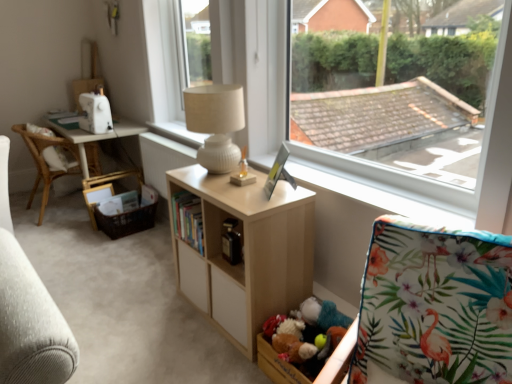
Where is `vacant region in front of white ribbed ceramic lamp at upper center`? The width and height of the screenshot is (512, 384). vacant region in front of white ribbed ceramic lamp at upper center is located at coordinates (221, 187).